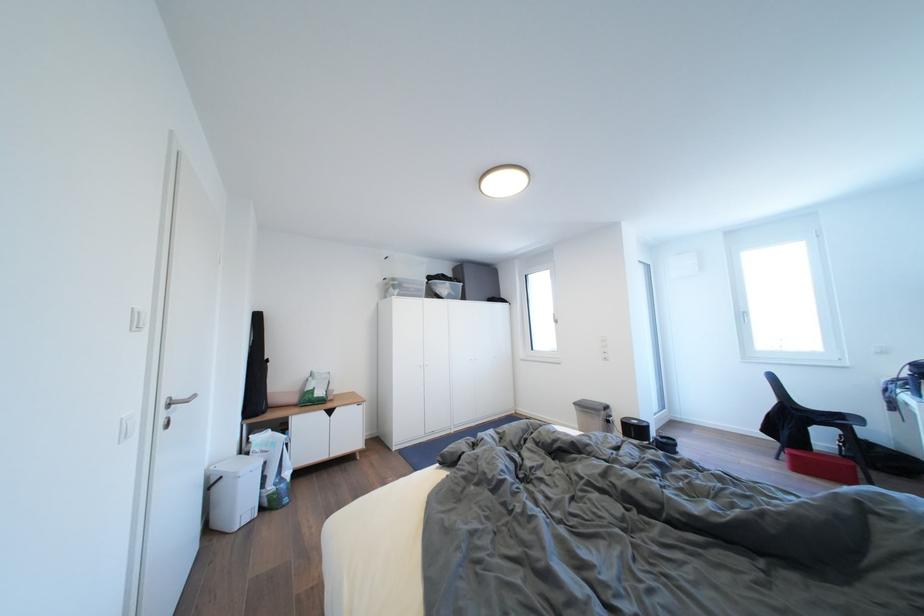
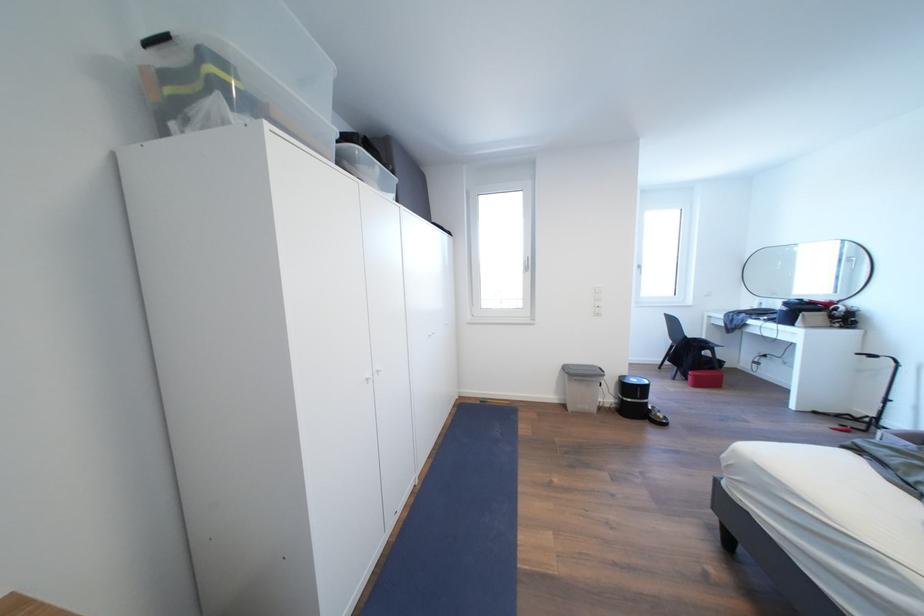
Where in the second image is the point corresponding to point (799, 460) from the first image?

(703, 381)